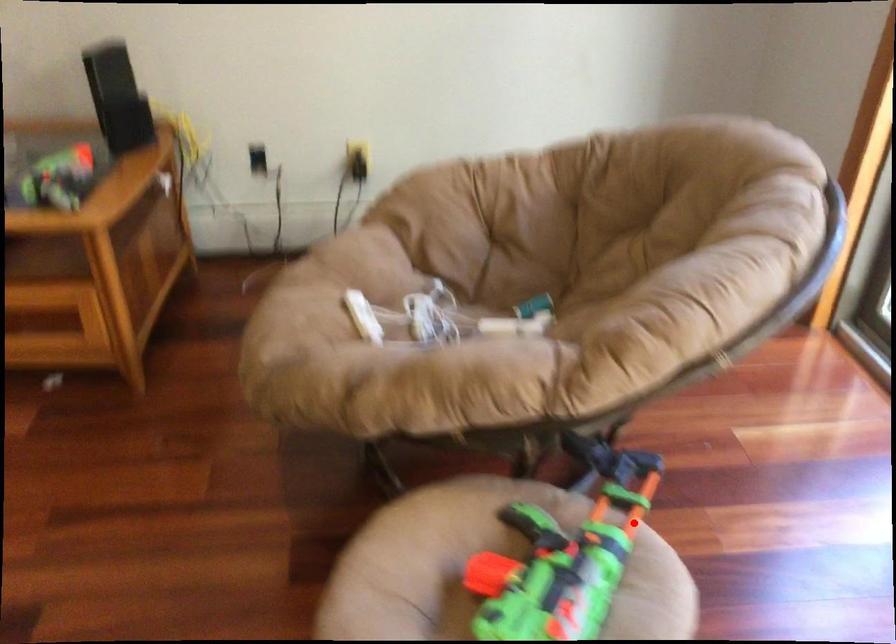
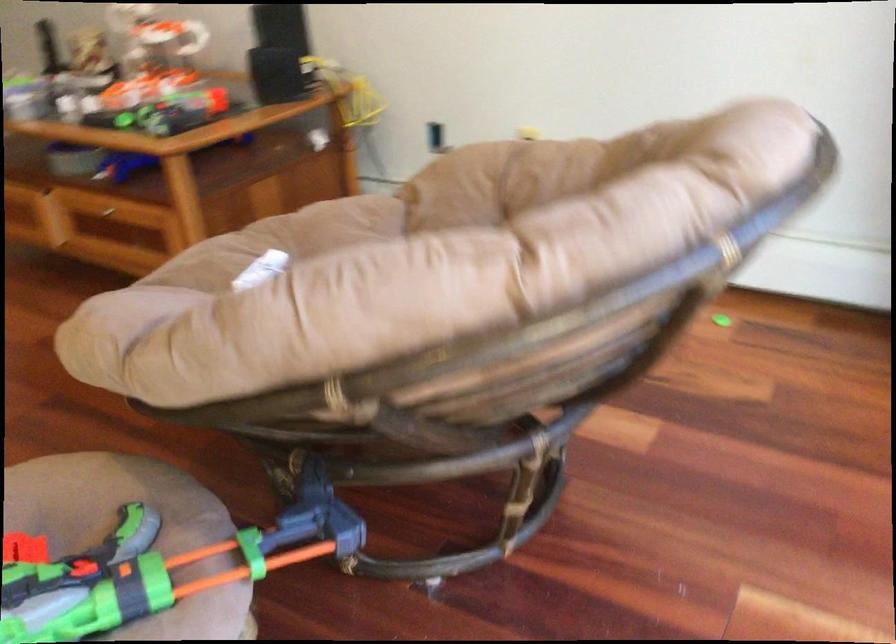
Question: I am providing you with two images of the same scene from different viewpoints. In image1, a red point is highlighted. Considering the same 3D point in image2, which of the following is correct?

Choices:
 (A) It is closer
 (B) It is farther

Answer: (A)